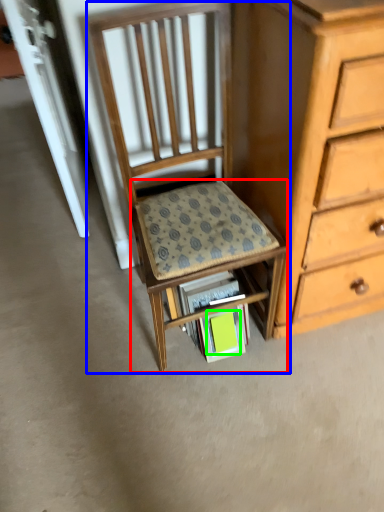
Question: Which object is the farthest from step stool (highlighted by a red box)? Choose among these: chair (highlighted by a blue box) or paperback book (highlighted by a green box).

Choices:
 (A) chair
 (B) paperback book

Answer: (B)